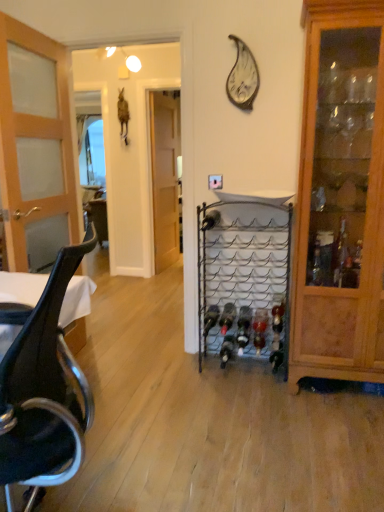
What are the coordinates of `vacant area that is situated to the right of light brown wooden door at left, the second door positioned from the right` in the screenshot? It's located at click(138, 374).